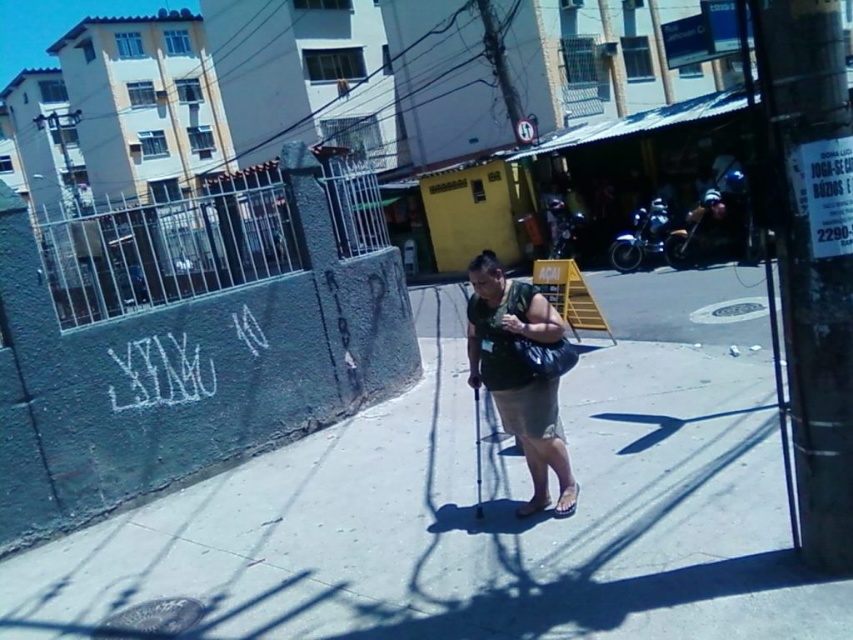
Question: Is metallic silver gate at upper left wider than brown leather sandal at lower right?

Choices:
 (A) yes
 (B) no

Answer: (A)

Question: Which of these objects is positioned farthest from the gray concrete pavement at center?

Choices:
 (A) dark green fabric bag at center
 (B) brown leather sandal at lower right

Answer: (B)

Question: Can you confirm if gray concrete pavement at center is positioned to the left of smooth black ski pole at center?

Choices:
 (A) no
 (B) yes

Answer: (A)

Question: Can you confirm if gray concrete pavement at center is positioned above smooth black ski pole at center?

Choices:
 (A) no
 (B) yes

Answer: (B)

Question: Estimate the real-world distances between objects in this image. Which object is closer to the smooth black ski pole at center?

Choices:
 (A) brown leather sandal at center
 (B) metallic silver gate at upper left
 (C) brown leather sandal at lower right
 (D) gray concrete pavement at center

Answer: (A)

Question: Which object appears farthest from the camera in this image?

Choices:
 (A) gray concrete pavement at center
 (B) brown leather sandal at center
 (C) brown leather sandal at lower right

Answer: (B)